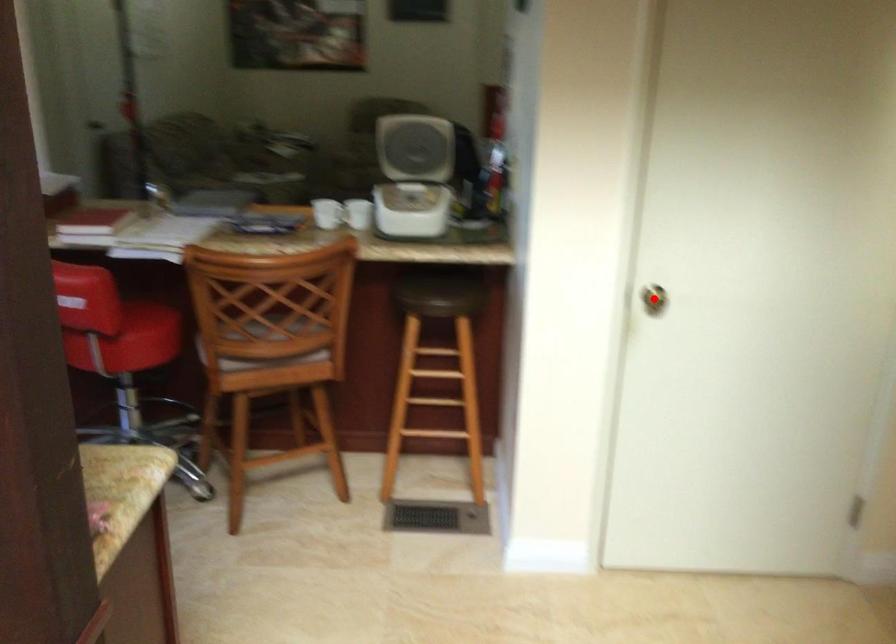
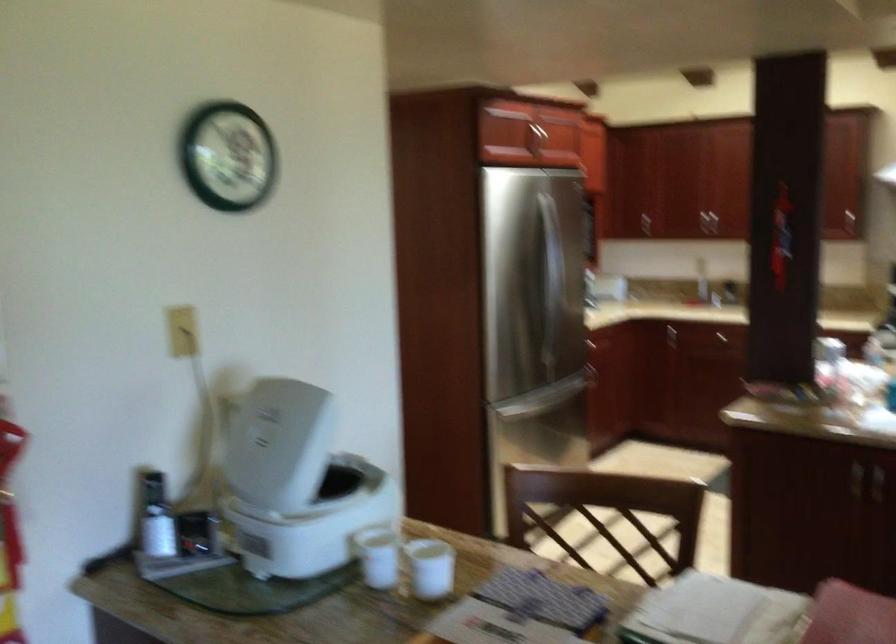
Question: I am providing you with two images of the same scene from different viewpoints. A red point is marked on the first image. At the location where the point appears in image 1, is it still visible in image 2?

Choices:
 (A) Yes
 (B) No

Answer: (B)